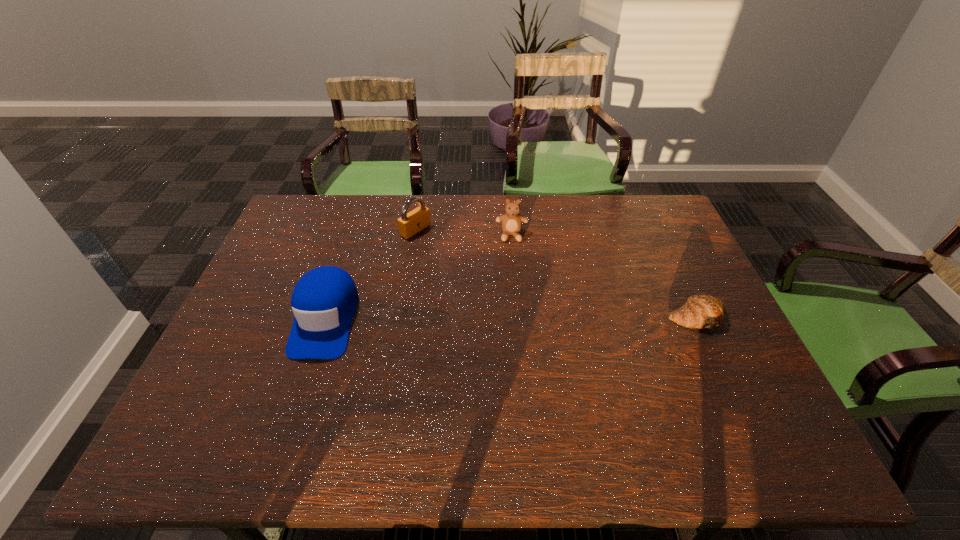
At what (x,y) coordinates should I click in order to perform the action: click on vacant space on the desktop that is between the baseball cap and the shortest object and is positioned to unlock the second object from left to right from the front. Please return your answer as a coordinate pair (x, y). This screenshot has height=540, width=960. Looking at the image, I should click on (562, 318).

Where is `vacant spot on the desktop that is between the leftmost object and the rightmost object and is positioned on the front-facing side of the second object from right to left`? The height and width of the screenshot is (540, 960). vacant spot on the desktop that is between the leftmost object and the rightmost object and is positioned on the front-facing side of the second object from right to left is located at coordinates (514, 318).